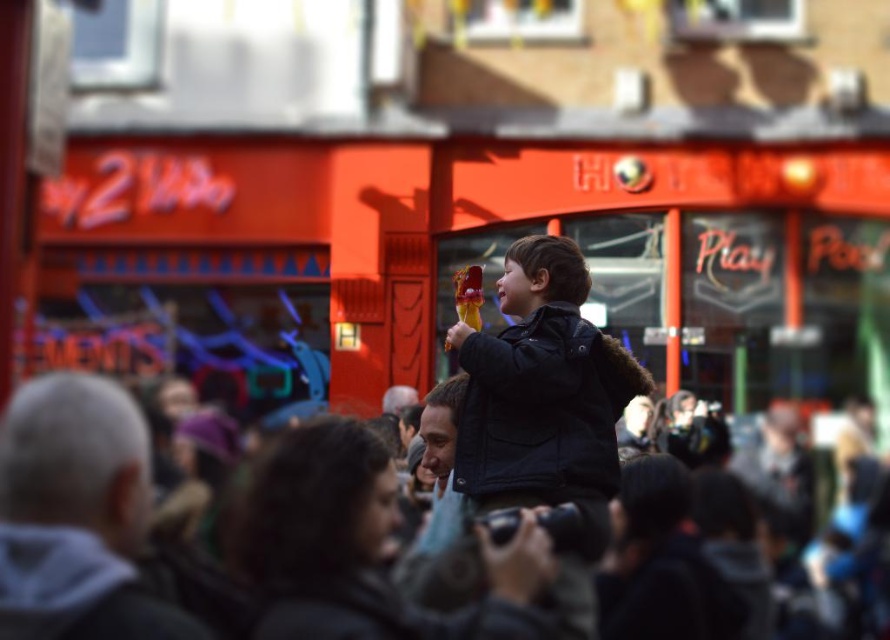
Question: Which object appears farthest from the camera in this image?

Choices:
 (A) dark brown hair at center
 (B) dark brown leather jacket at center
 (C) gray woolen hat at left

Answer: (A)

Question: Is gray woolen hat at left thinner than dark brown hair at center?

Choices:
 (A) yes
 (B) no

Answer: (B)

Question: Which of the following is the closest to the observer?

Choices:
 (A) gray woolen hat at left
 (B) dark brown leather jacket at center

Answer: (B)

Question: Does dark brown leather jacket at center appear over dark brown hair at center?

Choices:
 (A) yes
 (B) no

Answer: (A)

Question: Does dark brown leather jacket at center have a smaller size compared to gray woolen hat at left?

Choices:
 (A) no
 (B) yes

Answer: (A)

Question: Which object is positioned closest to the gray woolen hat at left?

Choices:
 (A) dark brown leather jacket at center
 (B) dark brown hair at center

Answer: (A)